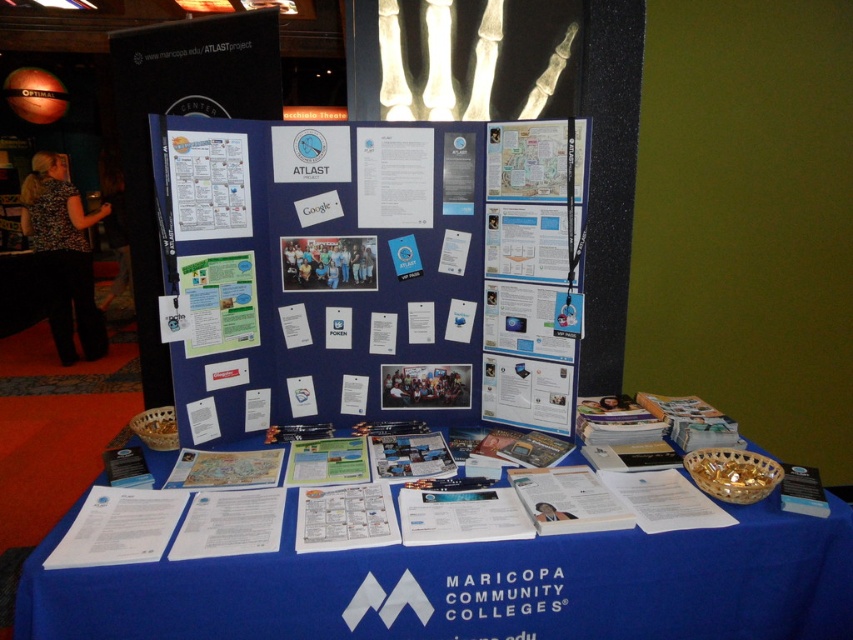
Does white paper at upper left appear under white paper at center?

Indeed, white paper at upper left is positioned under white paper at center.

Is white paper at upper left taller than white paper at center?

Correct, white paper at upper left is much taller as white paper at center.

Is point (229, 189) positioned in front of point (421, 154)?

Yes, point (229, 189) is closer to viewer.

At what (x,y) coordinates should I click in order to perform the action: click on white paper at upper left. Please return your answer as a coordinate pair (x, y). The image size is (853, 640). Looking at the image, I should click on (207, 184).

Which is in front, point (242, 308) or point (323, 237)?

Point (242, 308) is in front.

Who is taller, green paper at center or blue matte poster at center?

Standing taller between the two is green paper at center.

The width and height of the screenshot is (853, 640). What are the coordinates of `green paper at center` in the screenshot? It's located at (219, 301).

Who is shorter, white paper at upper left or blue matte poster at center?

blue matte poster at center is shorter.

Is white paper at upper left below blue matte poster at center?

No, white paper at upper left is not below blue matte poster at center.

Does point (218, 173) come behind point (349, 275)?

No, (218, 173) is closer to viewer.

This screenshot has height=640, width=853. I want to click on white paper at upper left, so click(207, 184).